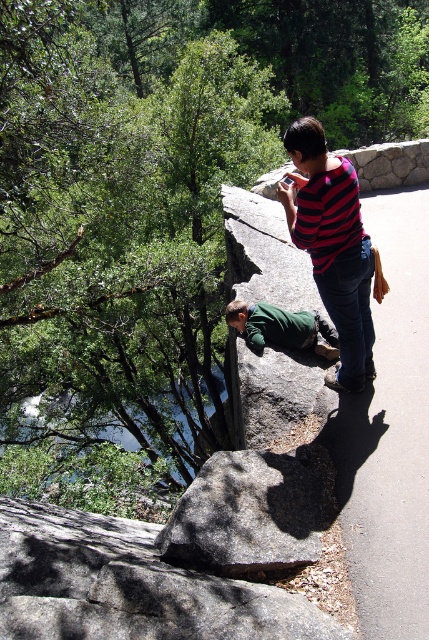
You are planning to place a small picnic basket between the gray granite rock at center and the green fuzzy sweater at lower center. Which object should you place the basket closer to if you want it to be near the smaller object?

The green fuzzy sweater at lower center is smaller than the gray granite rock at center, so you should place the basket closer to the green fuzzy sweater at lower center.

You are a photographer trying to capture both the green cotton shirt at center and the green fuzzy sweater at lower center in your shot. Which clothing item should you focus on first if you want to ensure both are in frame?

The green cotton shirt at center is located above the green fuzzy sweater at lower center, so you should focus on the green cotton shirt at center first to ensure both are in frame.